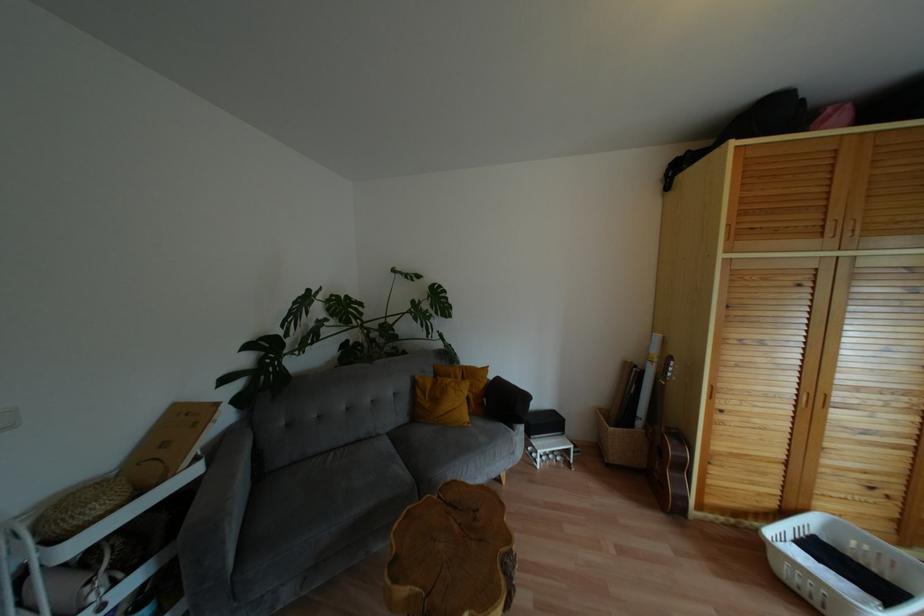
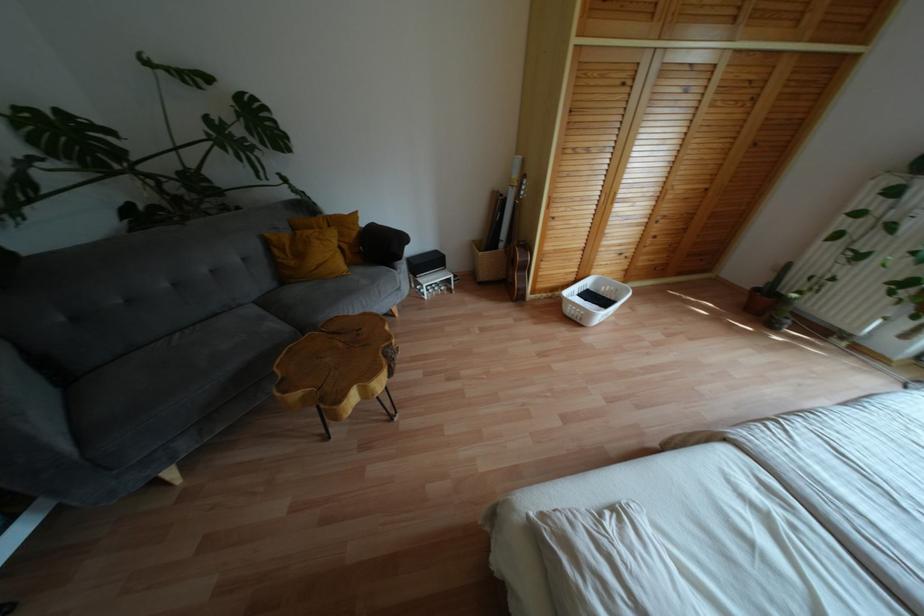
First-person continuous shooting, in which direction is the camera rotating?

The camera rotated toward right-down.